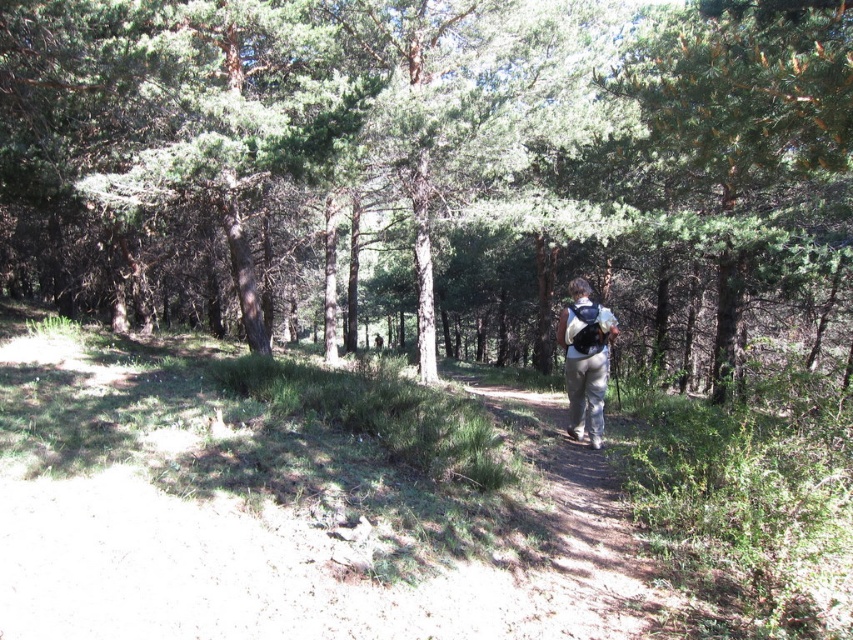
You are standing at the center of the dirt path in the forest scene. You want to take a photo of the green leafy tree at center. In which direction should you point your camera to capture it?

You should point your camera towards the center of the scene to capture the green leafy tree at center, as it is located at point coordinates of approximately (431, 166).